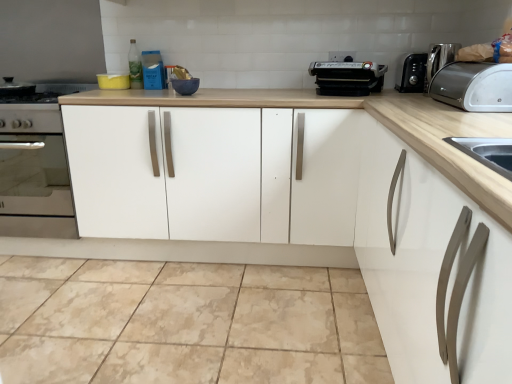
In order to click on unoccupied area in front of white matte cabinet at center in this screenshot , I will do `click(201, 318)`.